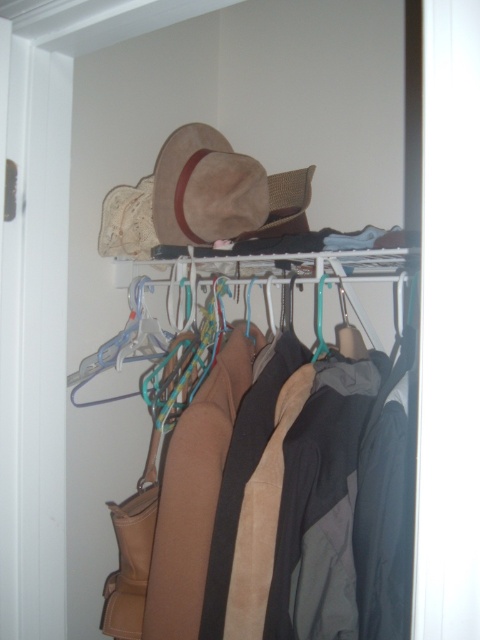
Question: Does suede brown cowboy hat at upper center appear over suede coat at center?

Choices:
 (A) yes
 (B) no

Answer: (A)

Question: Which object is farther from the camera taking this photo?

Choices:
 (A) suede coat at center
 (B) suede brown cowboy hat at upper center

Answer: (B)

Question: Which of the following is the closest to the observer?

Choices:
 (A) suede brown cowboy hat at upper center
 (B) suede coat at center

Answer: (B)

Question: Does suede brown cowboy hat at upper center have a smaller size compared to suede coat at center?

Choices:
 (A) no
 (B) yes

Answer: (B)

Question: Is suede brown cowboy hat at upper center closer to the viewer compared to suede coat at center?

Choices:
 (A) no
 (B) yes

Answer: (A)